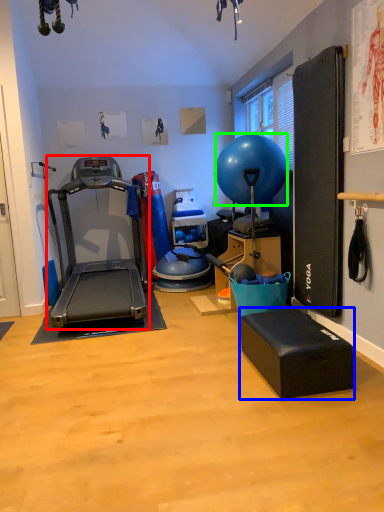
Question: Considering the real-world distances, which object is farthest from treadmill (highlighted by a red box)? footrest (highlighted by a blue box) or ball (highlighted by a green box)?

Choices:
 (A) footrest
 (B) ball

Answer: (A)